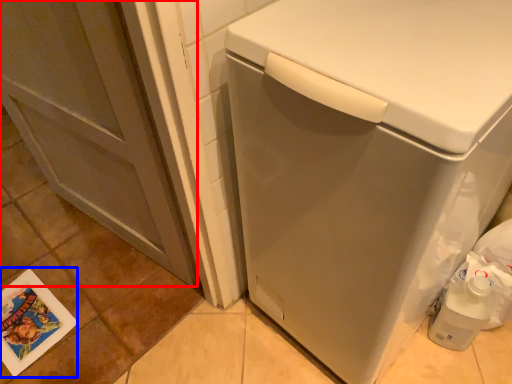
Question: Among these objects, which one is farthest to the camera, screen door (highlighted by a red box) or postcard (highlighted by a blue box)?

Choices:
 (A) screen door
 (B) postcard

Answer: (B)